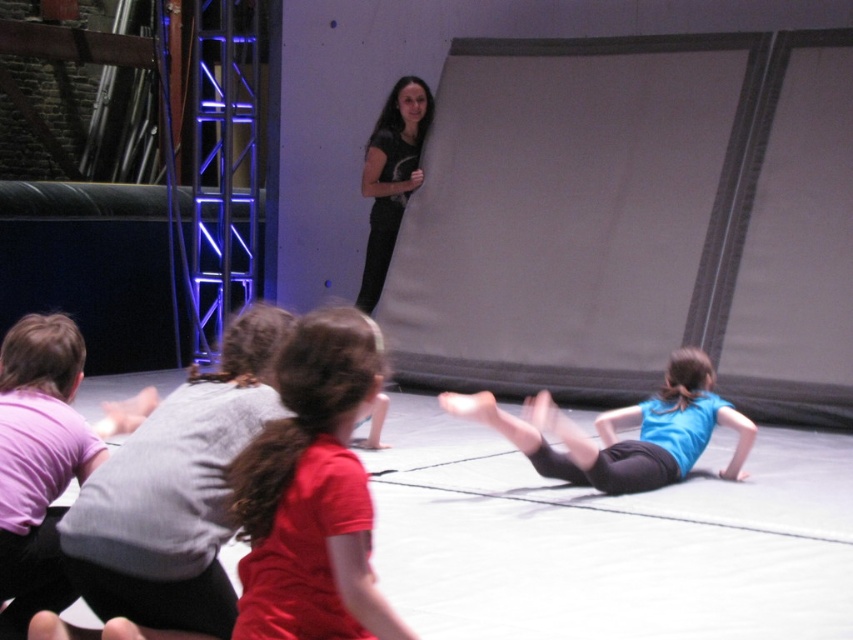
You are a photographer positioned at the back of the studio. You want to take a photo of the matte gray shirt at lower left and the matte red shirt at center. Which child should you adjust your focus on first to ensure both are in clear view?

The matte gray shirt at lower left is closer to you than the matte red shirt at center, so you should focus on the matte gray shirt at lower left first to ensure both are in clear view.